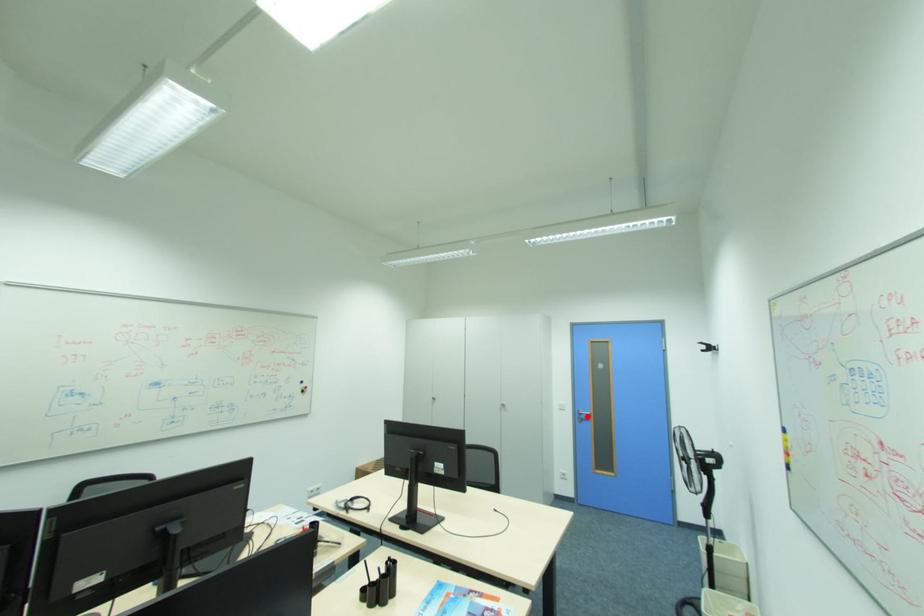
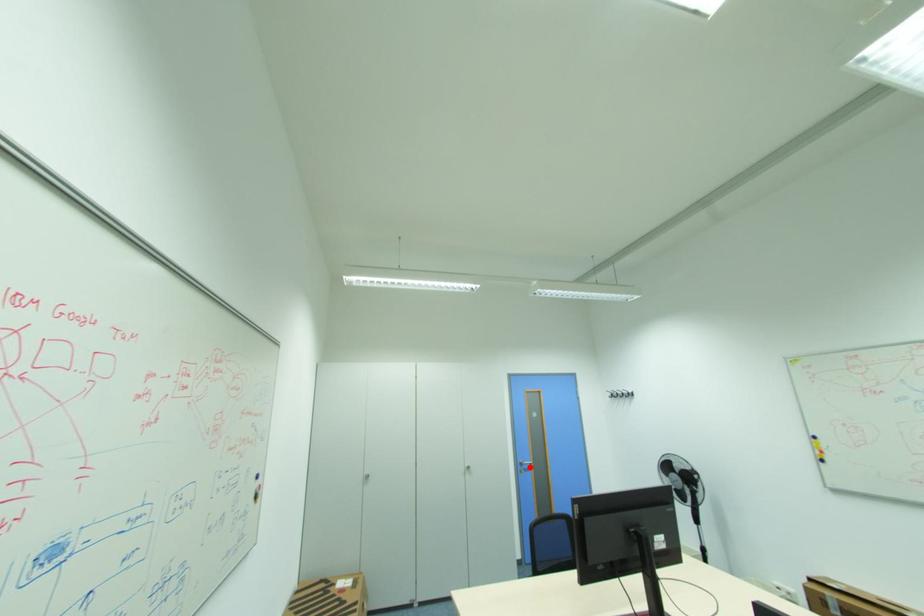
I am providing you with two images of the same scene from different viewpoints. A red point is marked on the first image and another point is marked on the second image. Are the points marked in image1 and image2 representing the same 3D position?

Yes